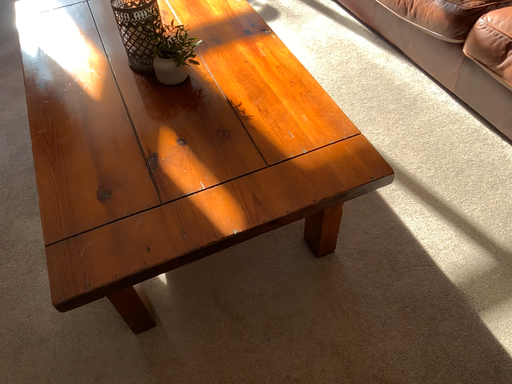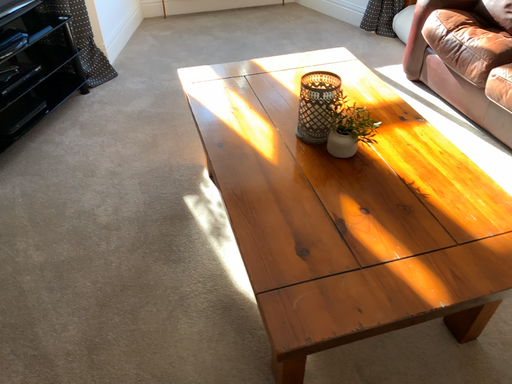
Question: How did the camera likely rotate when shooting the video?

Choices:
 (A) rotated upward
 (B) rotated downward

Answer: (A)